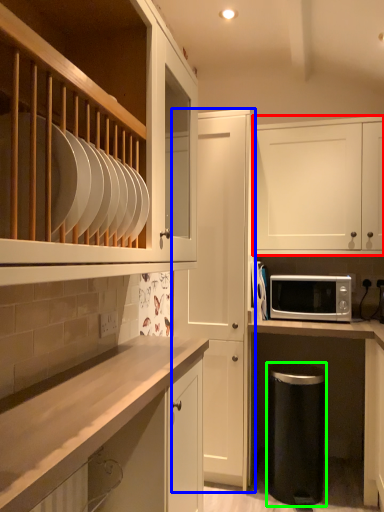
Question: Which object is the closest to the cabinetry (highlighted by a red box)? Choose among these: cabinetry (highlighted by a blue box) or dish washer (highlighted by a green box).

Choices:
 (A) cabinetry
 (B) dish washer

Answer: (A)